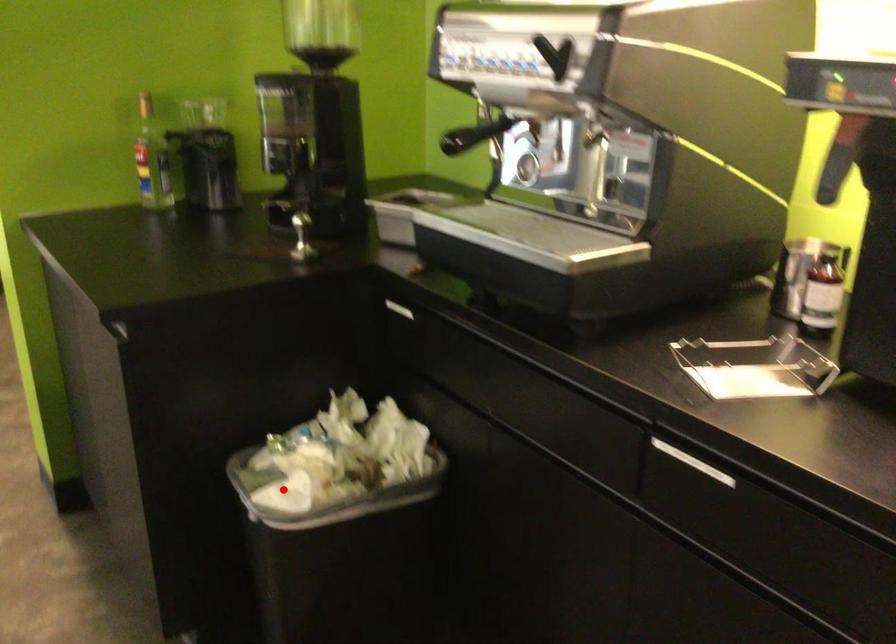
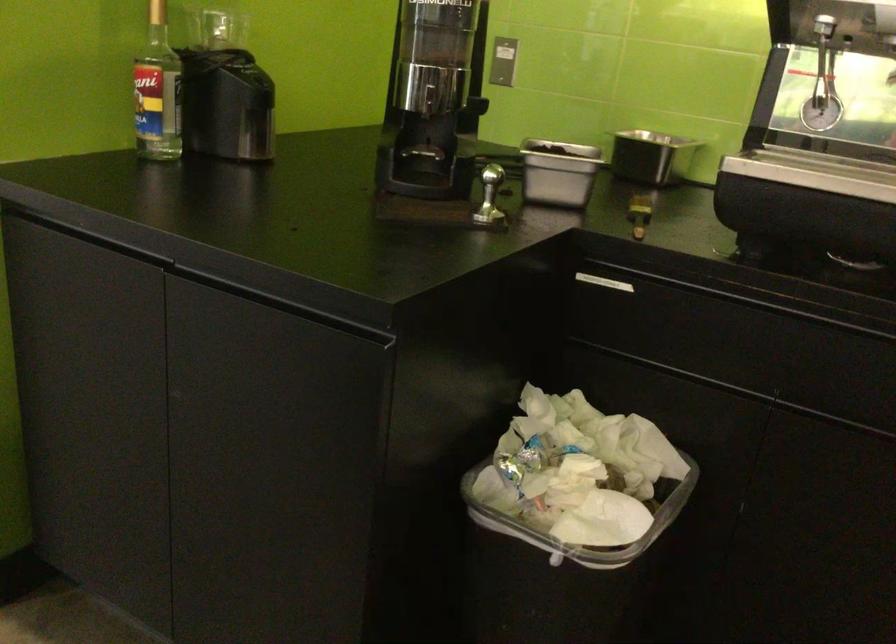
The point at the highlighted location is marked in the first image. Where is the corresponding point in the second image?

(581, 524)